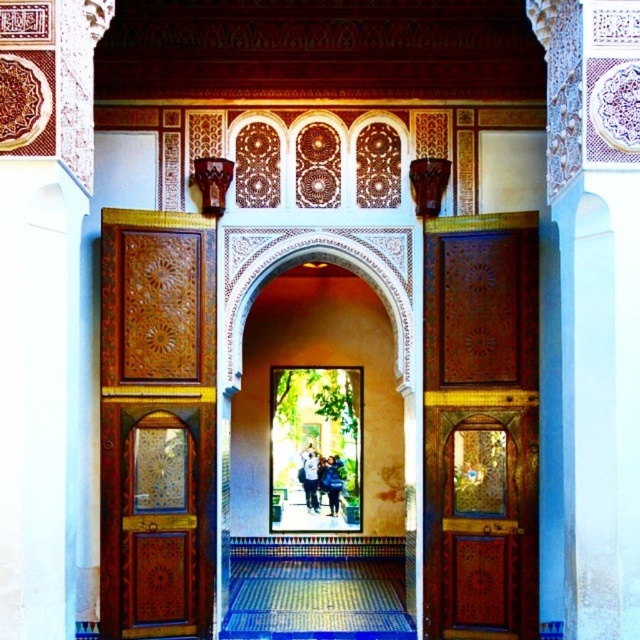
You are standing in the entrance and want to move towards the polished wood door at right without stepping on the light blue jeans at center. Which direction should you move?

You should move to the right side, as the polished wood door at right is located to the right of the light blue jeans at center, so moving right will avoid stepping on the light blue jeans at center.

You are standing in the entrance and see the point at coordinate (308, 477). What object is located at that point?

The point at coordinate (308, 477) is on light blue jeans at center.